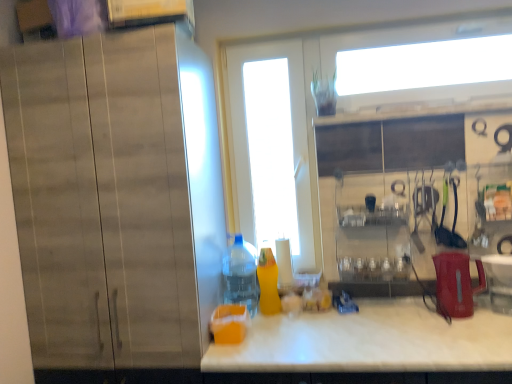
Where is `free location in front of yellow glass bottle at center, which is the 1th bottle from right to left`? The height and width of the screenshot is (384, 512). free location in front of yellow glass bottle at center, which is the 1th bottle from right to left is located at coordinates (275, 326).